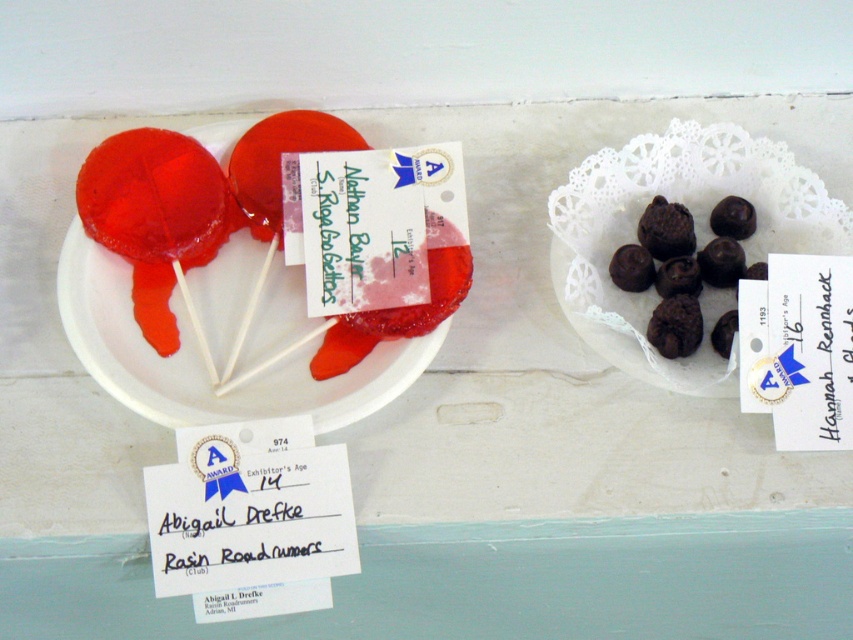
In the scene shown: You are a judge at a candy fair and need to determine which point is closer to you. You see the two points labeled as point [614,164] and point [642,221] in the image. Which point is closer to your position?

Point [614,164] is closer to you than point [642,221] because it is further to the viewer according to the description.